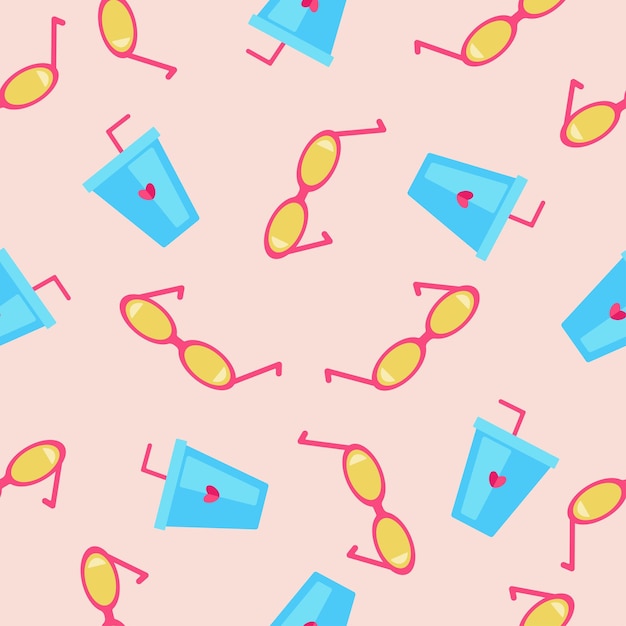
What are the coordinates of `cup` in the screenshot? It's located at (27, 294), (116, 185), (322, 39), (429, 173), (257, 495), (317, 586), (495, 436), (590, 332).